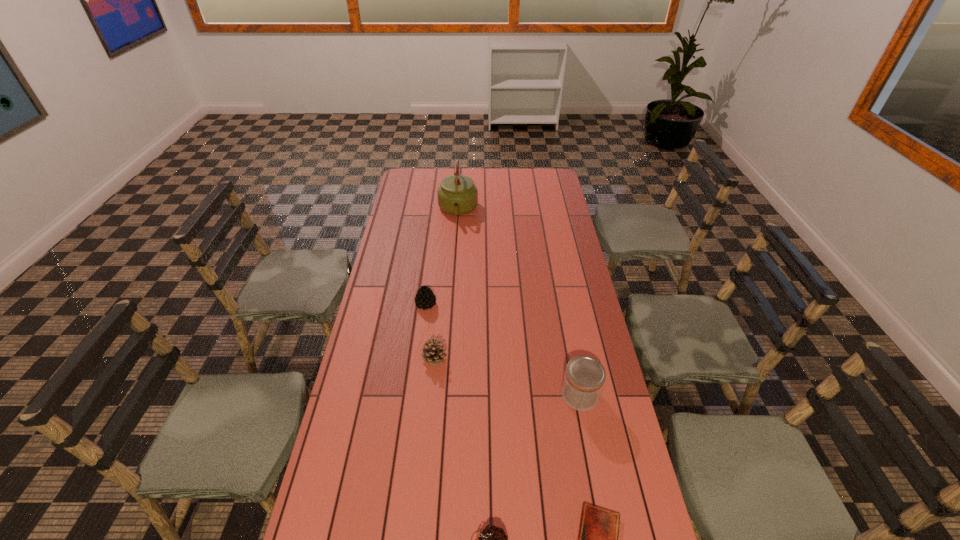
Identify which object is located as the fourth nearest to the diary. Please provide its 2D coordinates. Your answer should be formatted as a tuple, i.e. [(x, y)], where the tuple contains the x and y coordinates of a point satisfying the conditions above.

[(425, 298)]

Identify which pinecone is the second nearest to the second nearest pinecone. Please provide its 2D coordinates. Your answer should be formatted as a tuple, i.e. [(x, y)], where the tuple contains the x and y coordinates of a point satisfying the conditions above.

[(492, 539)]

Where is `pinecone that is the closest to the nearest pinecone`? pinecone that is the closest to the nearest pinecone is located at coordinates (432, 352).

Identify the location of vacant point that satisfies the following two spatial constraints: 1. at the spout of the fourth farthest object; 2. on the left side of the tallest object. The image size is (960, 540). (445, 395).

Where is `vacant space that satisfies the following two spatial constraints: 1. at the spout of the kettle; 2. on the right side of the fourth farthest object`? vacant space that satisfies the following two spatial constraints: 1. at the spout of the kettle; 2. on the right side of the fourth farthest object is located at coordinates (445, 395).

Find the location of a particular element. This screenshot has height=540, width=960. vacant space that satisfies the following two spatial constraints: 1. at the narrow end of the second farthest object; 2. on the left side of the second nearest pinecone is located at coordinates (419, 358).